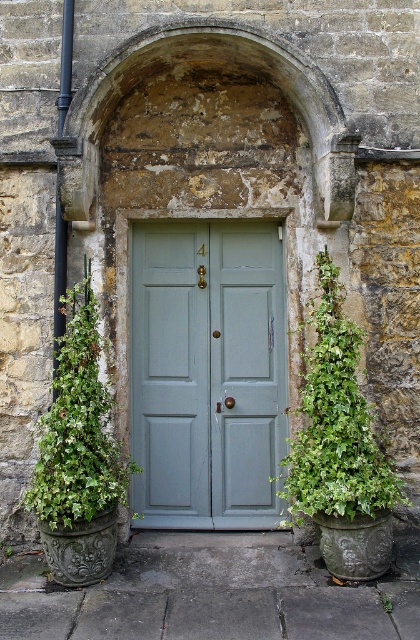
Question: Does green leafy plant at center appear on the left side of green leafy plant at left?

Choices:
 (A) no
 (B) yes

Answer: (A)

Question: Considering the real-world distances, which object is closest to the green leafy plant at left?

Choices:
 (A) matte green door at center
 (B) green leafy plant at center

Answer: (A)

Question: Does matte green door at center appear on the left side of green leafy plant at center?

Choices:
 (A) no
 (B) yes

Answer: (B)

Question: Is matte green door at center to the right of green leafy plant at left from the viewer's perspective?

Choices:
 (A) yes
 (B) no

Answer: (A)

Question: Which of the following is the closest to the observer?

Choices:
 (A) green leafy plant at left
 (B) green leafy plant at center

Answer: (B)

Question: Which object appears closest to the camera in this image?

Choices:
 (A) green leafy plant at left
 (B) matte green door at center

Answer: (A)